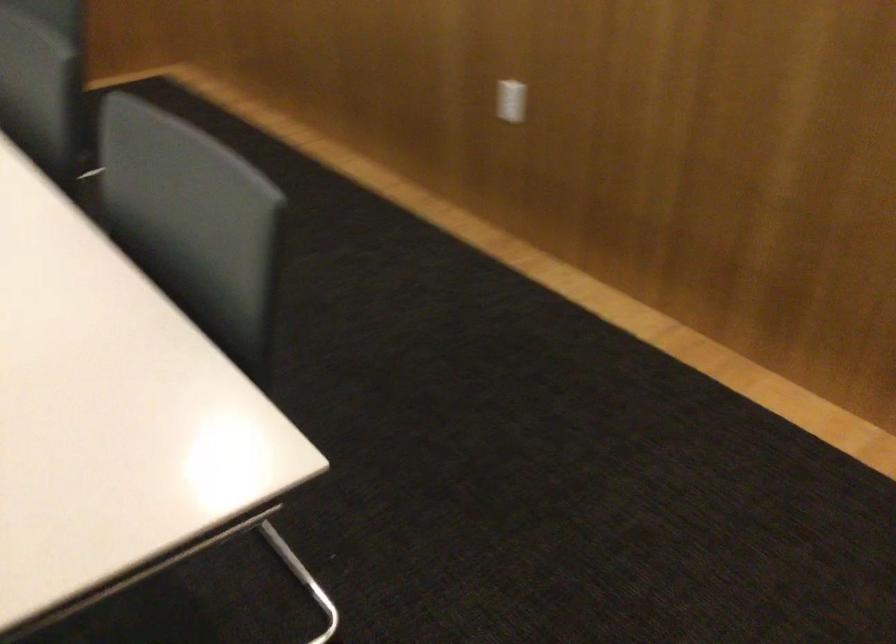
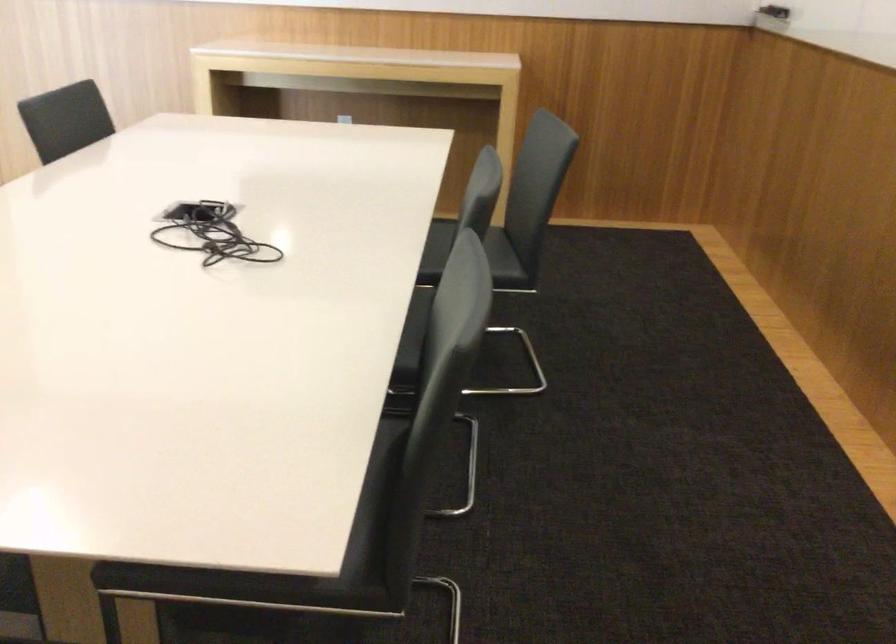
In the second image, find the point that corresponds to the point at 287,462 in the first image.

(311, 558)